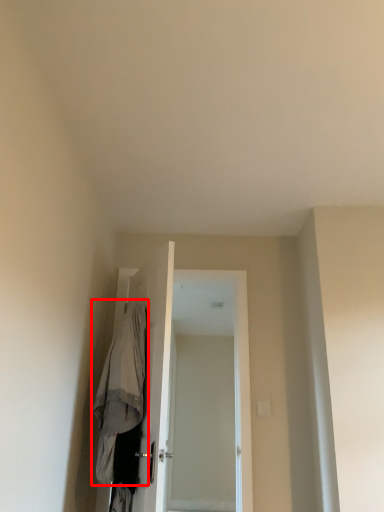
Question: In this image, where is robe (annotated by the red box) located relative to screen door?

Choices:
 (A) left
 (B) right

Answer: (A)